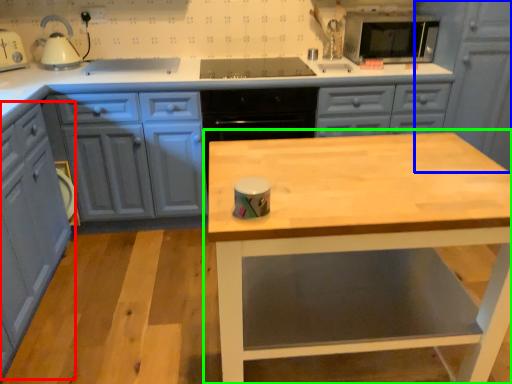
Question: Based on their relative distances, which object is nearer to cabinetry (highlighted by a red box)? Choose from cabinetry (highlighted by a blue box) and table (highlighted by a green box).

Choices:
 (A) cabinetry
 (B) table

Answer: (B)